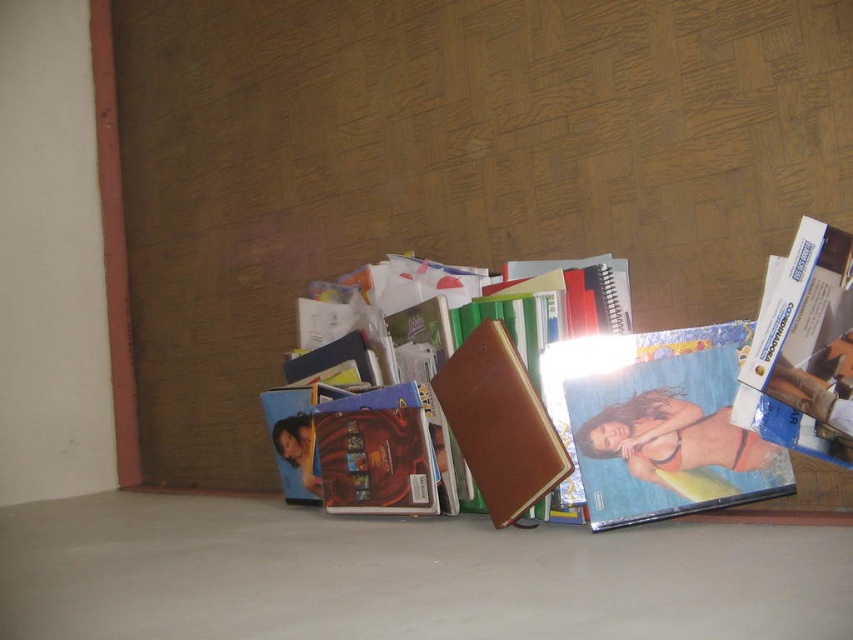
Can you confirm if matte plastic photo at center is bigger than brown leather wallet at center?

Actually, matte plastic photo at center might be smaller than brown leather wallet at center.

What do you see at coordinates (657, 424) in the screenshot?
I see `matte plastic photo at center` at bounding box center [657, 424].

Identify the location of matte plastic photo at center. Image resolution: width=853 pixels, height=640 pixels. (657, 424).

Describe the element at coordinates (457, 307) in the screenshot. The height and width of the screenshot is (640, 853). I see `brown leather wallet at center` at that location.

Does point (445, 320) come closer to viewer compared to point (759, 352)?

No, (445, 320) is further to viewer.

Where is `brown leather wallet at center`? This screenshot has height=640, width=853. brown leather wallet at center is located at coordinates (457, 307).

Where is `matte plastic photo at center`? matte plastic photo at center is located at coordinates (657, 424).

Is matte plastic photo at center above blue glossy book at center?

Incorrect, matte plastic photo at center is not positioned above blue glossy book at center.

Which is in front, point (724, 500) or point (821, 225)?

Point (821, 225) is in front.

Where is `matte plastic photo at center`? matte plastic photo at center is located at coordinates (657, 424).